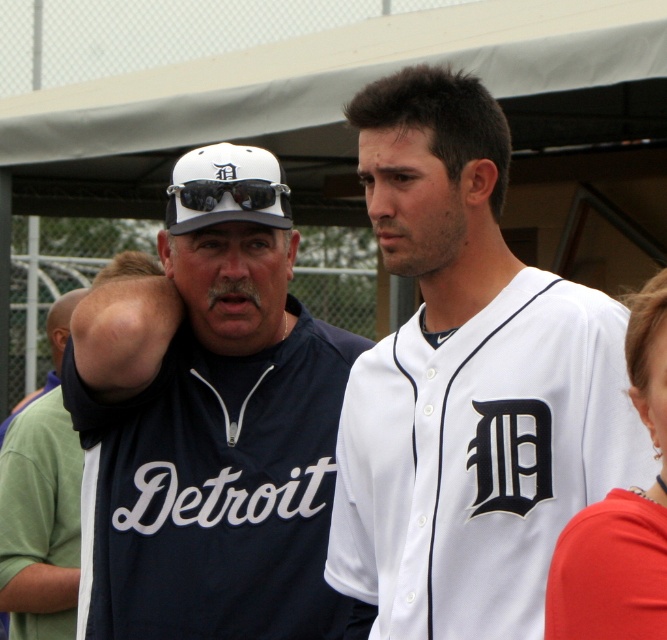
Can you confirm if white jersey at center is bigger than navy blue jersey at left?

Yes, white jersey at center is bigger than navy blue jersey at left.

Does white jersey at center have a greater height compared to navy blue jersey at left?

Correct, white jersey at center is much taller as navy blue jersey at left.

Who is more distant from viewer, [482,600] or [223,340]?

Positioned behind is point [223,340].

Locate an element on the screen. The image size is (667, 640). white jersey at center is located at coordinates (468, 384).

Does white jersey at center have a greater height compared to green jersey at left?

Yes.

In the scene shown: Is white jersey at center smaller than green jersey at left?

Incorrect, white jersey at center is not smaller in size than green jersey at left.

This screenshot has width=667, height=640. What do you see at coordinates (468, 384) in the screenshot?
I see `white jersey at center` at bounding box center [468, 384].

Image resolution: width=667 pixels, height=640 pixels. I want to click on white jersey at center, so point(468,384).

Does navy blue jersey at left appear on the right side of white matte baseball cap at upper center?

Indeed, navy blue jersey at left is positioned on the right side of white matte baseball cap at upper center.

Does navy blue jersey at left appear under white matte baseball cap at upper center?

Correct, navy blue jersey at left is located below white matte baseball cap at upper center.

Measure the distance between navy blue jersey at left and camera.

A distance of 5.34 meters exists between navy blue jersey at left and camera.

This screenshot has height=640, width=667. Find the location of `navy blue jersey at left`. navy blue jersey at left is located at coordinates pyautogui.click(x=209, y=424).